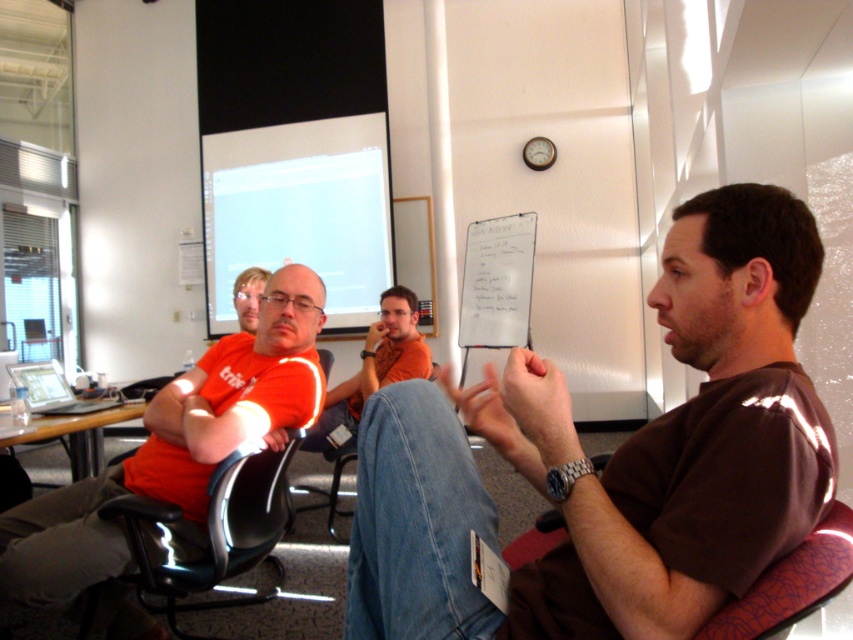
Question: Is brown cotton shirt at center closer to the viewer compared to orange t-shirt at left?

Choices:
 (A) yes
 (B) no

Answer: (A)

Question: Which of the following is the farthest from the observer?

Choices:
 (A) (467, 285)
 (B) (161, 582)
 (C) (180, 499)

Answer: (A)

Question: Which point is closer to the camera taking this photo?

Choices:
 (A) (109, 506)
 (B) (326, 440)
 (C) (38, 580)
 (D) (479, 344)

Answer: (C)

Question: Is black leather chair at left further to the viewer compared to orange t-shirt at center?

Choices:
 (A) yes
 (B) no

Answer: (B)

Question: Which object is positioned closest to the orange t-shirt at left?

Choices:
 (A) orange t-shirt at center
 (B) whiteboard at center
 (C) brown cotton shirt at center
 (D) black leather chair at left

Answer: (D)

Question: From the image, what is the correct spatial relationship of brown cotton shirt at center in relation to orange t-shirt at center?

Choices:
 (A) left
 (B) right

Answer: (B)